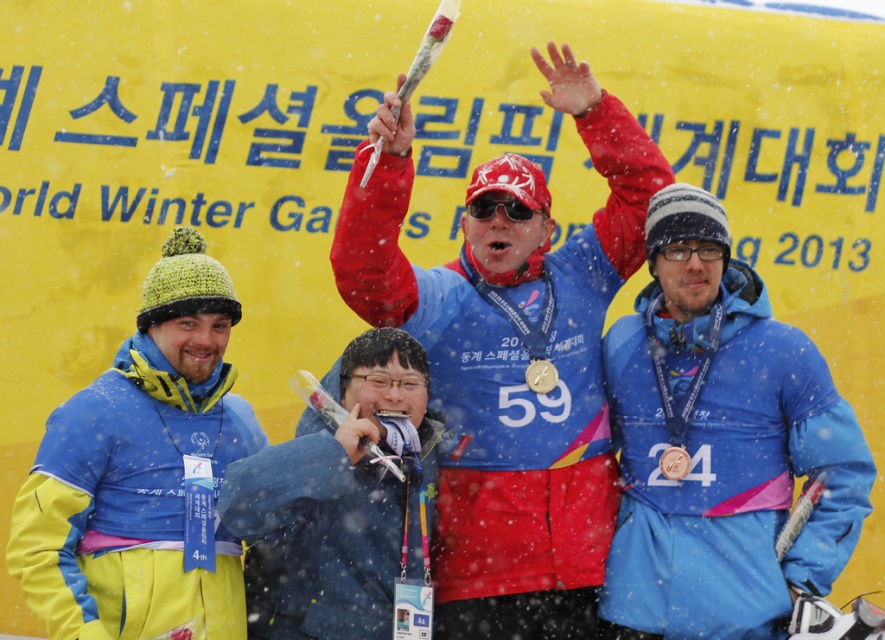
Question: Which of the following is the closest to the observer?

Choices:
 (A) (543, 376)
 (B) (694, 385)

Answer: (B)

Question: Which is nearer to the blue fabric jacket at center?

Choices:
 (A) gold metallic medal at center
 (B) yellow fleece jacket at left
 (C) matte black goggles at center

Answer: (B)

Question: Can you confirm if blue synthetic jacket at center is wider than blue fabric jacket at center?

Choices:
 (A) yes
 (B) no

Answer: (A)

Question: Can you confirm if blue synthetic jacket at center is bigger than yellow fleece jacket at left?

Choices:
 (A) no
 (B) yes

Answer: (B)

Question: Does blue fabric jacket at center appear under gold metallic medal at center?

Choices:
 (A) no
 (B) yes

Answer: (B)

Question: Which of these objects is positioned closest to the gold metallic medal at center?

Choices:
 (A) blue synthetic jacket at center
 (B) blue fabric jacket at center
 (C) matte black goggles at center
 (D) yellow fleece jacket at left

Answer: (C)